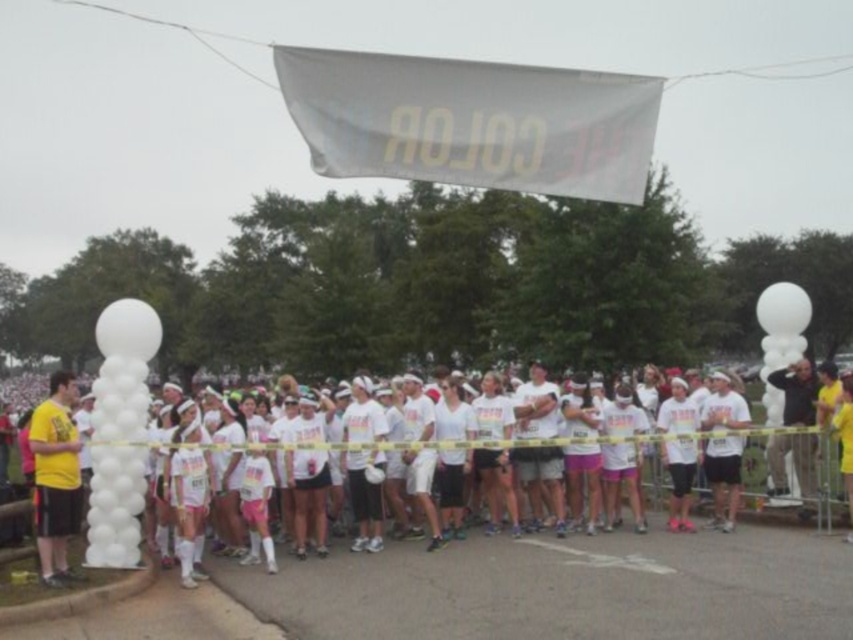
Question: Can you confirm if yellow matte t-shirt at left is wider than white matte t-shirt at center?

Choices:
 (A) no
 (B) yes

Answer: (B)

Question: Can you confirm if white matte t-shirt at center is wider than yellow matte shorts at center?

Choices:
 (A) no
 (B) yes

Answer: (B)

Question: In this image, where is white fabric banner at upper center located relative to white matte balloon at center?

Choices:
 (A) right
 (B) left

Answer: (A)

Question: Among these points, which one is nearest to the camera?

Choices:
 (A) (822, 492)
 (B) (105, 413)

Answer: (B)

Question: Which object is positioned closest to the white matte balloon at left?

Choices:
 (A) yellow matte t-shirt at left
 (B) white fabric banner at upper center
 (C) white matte t-shirt at center
 (D) dark gray jacket at right

Answer: (A)

Question: Which object appears farthest from the camera in this image?

Choices:
 (A) white fabric banner at upper center
 (B) white matte balloon at left
 (C) white matte balloon at center

Answer: (B)